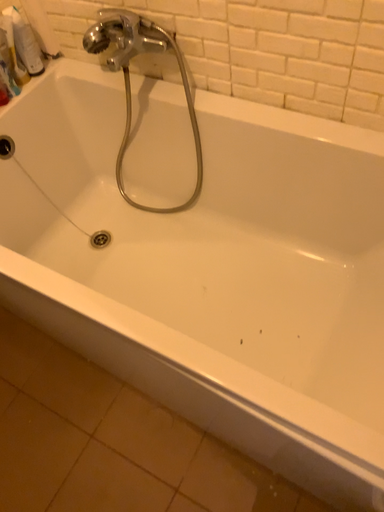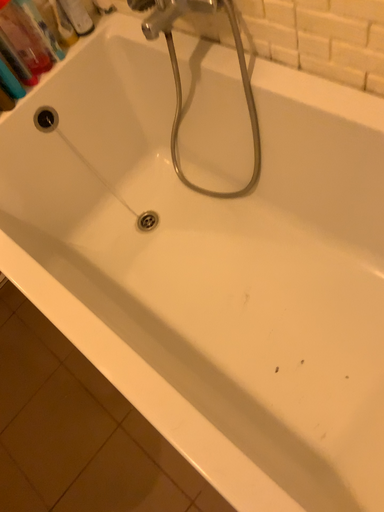
Question: How did the camera likely rotate when shooting the video?

Choices:
 (A) rotated left
 (B) rotated right

Answer: (A)